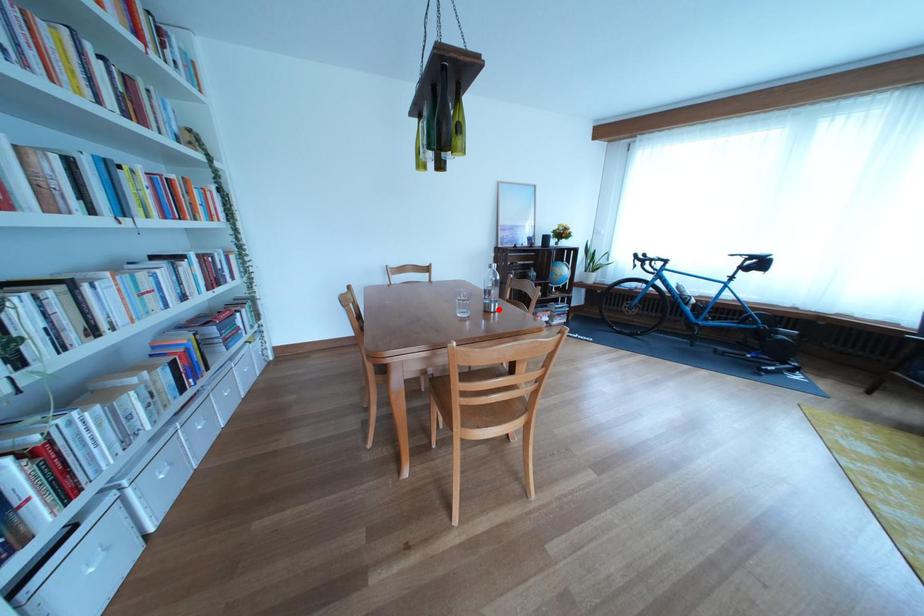
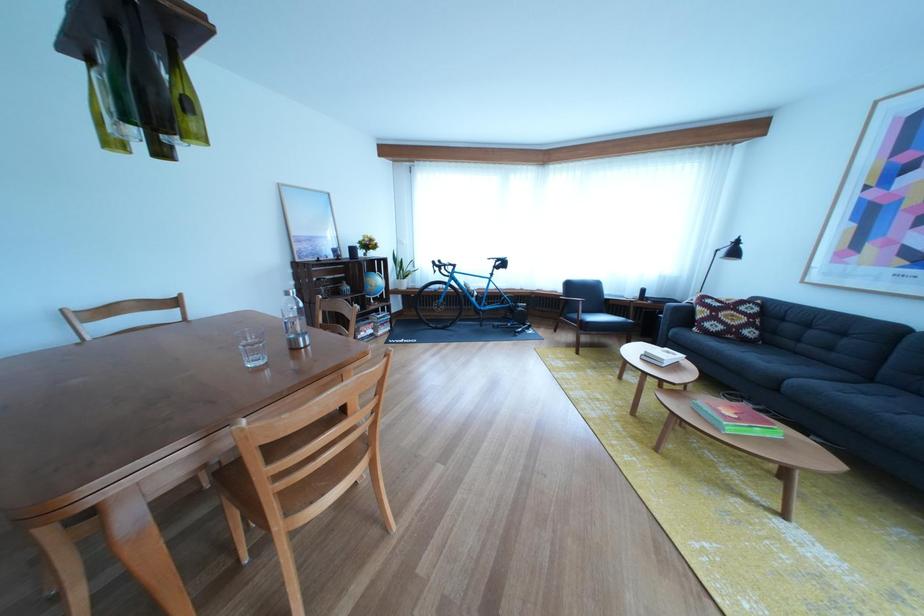
Question: A red point is marked in image1. In image2, is the corresponding 3D point closer to the camera or farther? Reply with the corresponding letter.

Choices:
 (A) The corresponding 3D point is closer.
 (B) The corresponding 3D point is farther.

Answer: (A)